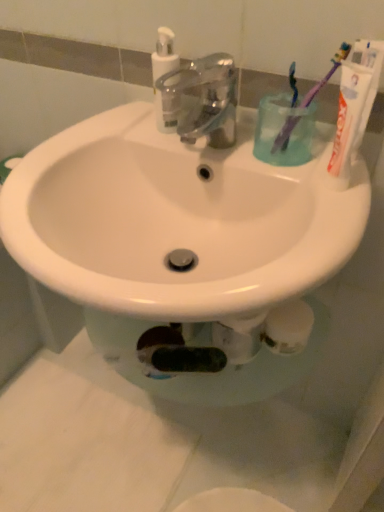
Find the location of `free space to the left of metallic faucet at center`. free space to the left of metallic faucet at center is located at coordinates (109, 139).